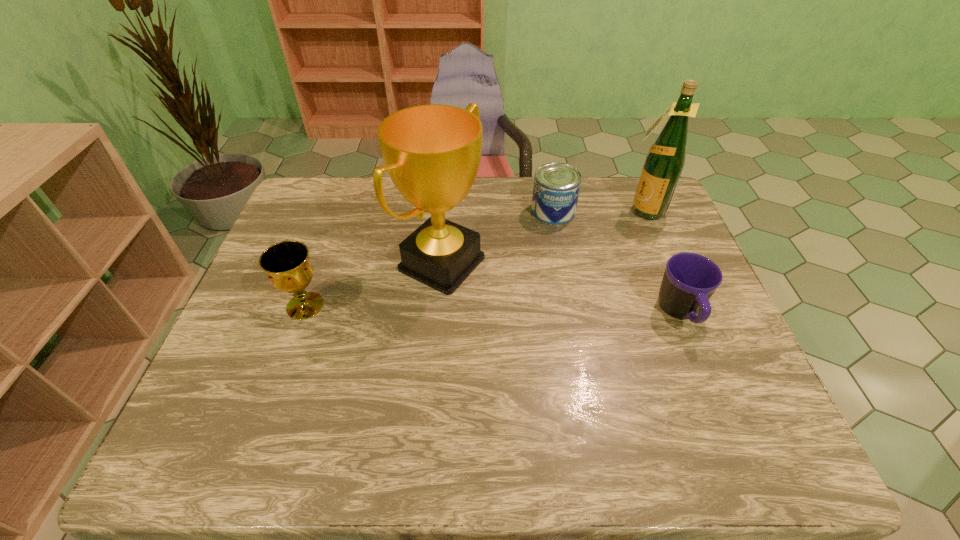
You are a GUI agent. You are given a task and a screenshot of the screen. Output one action in this format:
    pyautogui.click(x=<x>, y=<y>)
    Task: Click on the free space between the third object from left to right and the award
    The width and height of the screenshot is (960, 540).
    Given the screenshot: What is the action you would take?
    pyautogui.click(x=497, y=237)

Locate an element on the screen. vacant space in between the third object from right to left and the second object from left to right is located at coordinates (497, 237).

Where is `free space between the fourth object from right to left and the liquor`? The width and height of the screenshot is (960, 540). free space between the fourth object from right to left and the liquor is located at coordinates [542, 237].

This screenshot has height=540, width=960. I want to click on unoccupied position between the mug and the third tallest object, so click(492, 310).

At what (x,y) coordinates should I click in order to perform the action: click on vacant area between the mug and the third tallest object. Please return your answer as a coordinate pair (x, y). The image size is (960, 540). Looking at the image, I should click on (492, 310).

The image size is (960, 540). Identify the location of free space between the liquor and the mug. (661, 262).

This screenshot has width=960, height=540. Find the location of `empty location between the second object from left to right and the liquor`. empty location between the second object from left to right and the liquor is located at coordinates (542, 237).

At what (x,y) coordinates should I click in order to perform the action: click on free space between the chalice and the award. Please return your answer as a coordinate pair (x, y). The image size is (960, 540). Looking at the image, I should click on (373, 285).

The width and height of the screenshot is (960, 540). I want to click on unoccupied position between the liquor and the mug, so click(661, 262).

Identify which object is the second closest to the award. Please provide its 2D coordinates. Your answer should be formatted as a tuple, i.e. [(x, y)], where the tuple contains the x and y coordinates of a point satisfying the conditions above.

[(287, 264)]